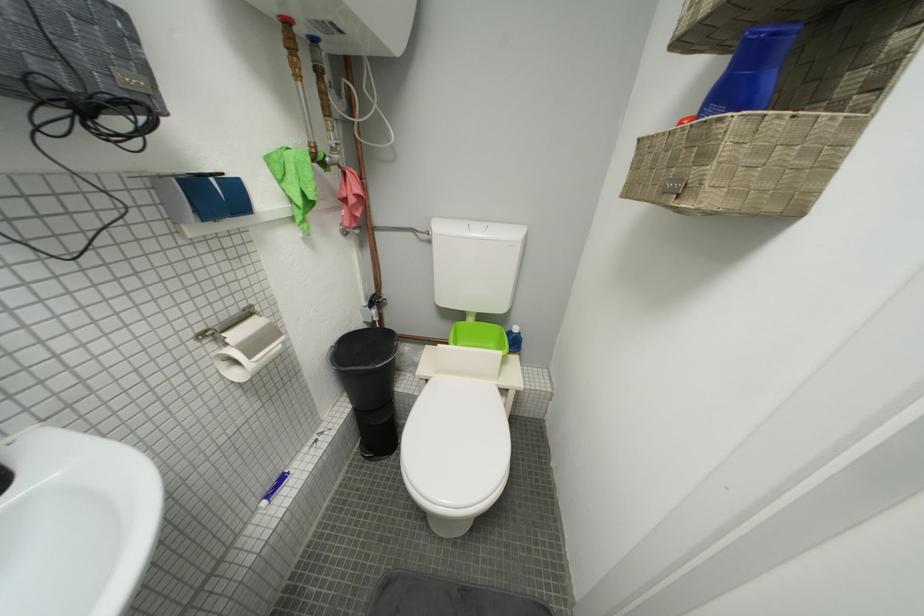
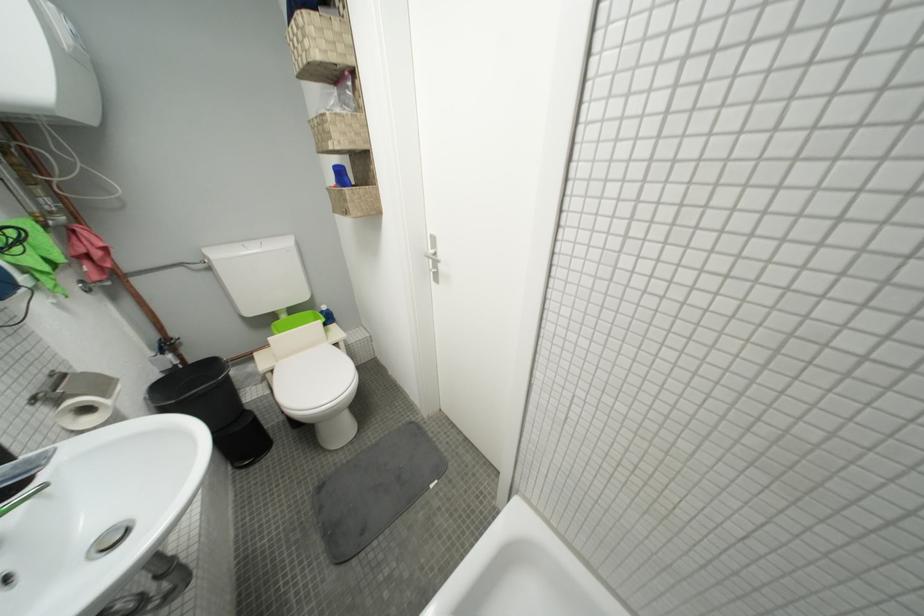
Locate, in the second image, the point that corresponds to (x=479, y=322) in the first image.

(293, 318)